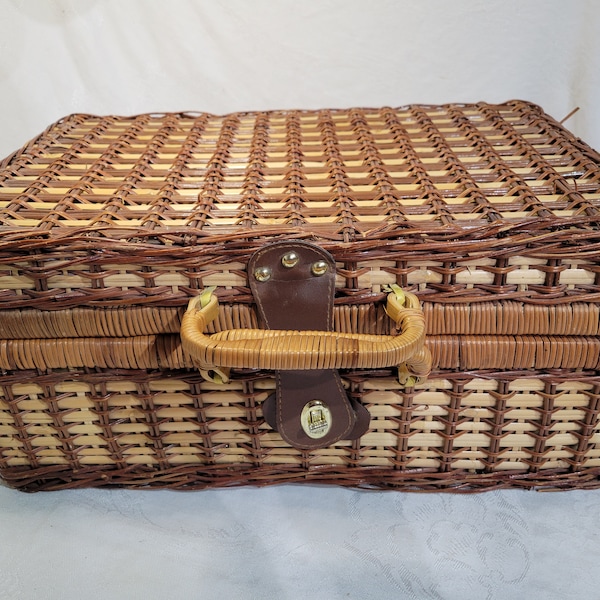
In order to click on bottom part of case in this screenshot , I will do `click(501, 425)`.